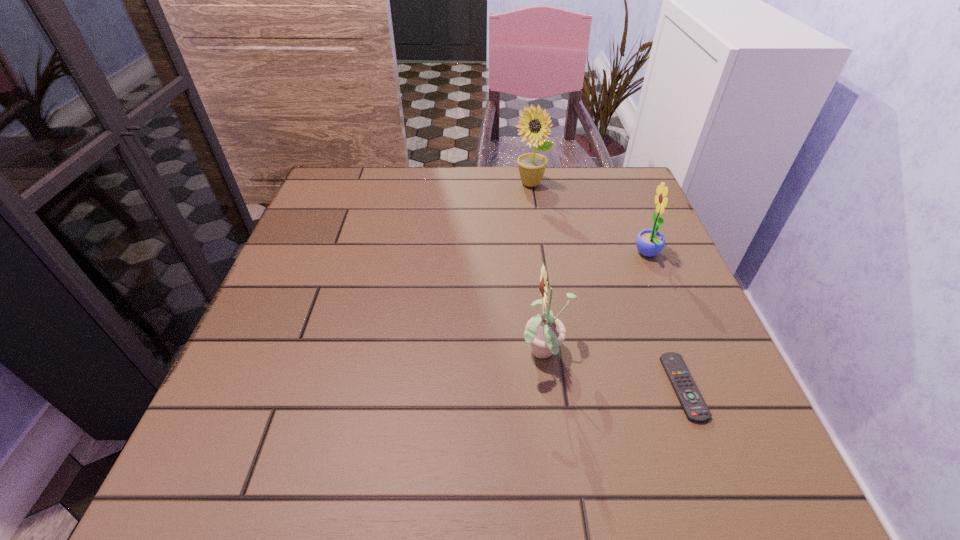
The width and height of the screenshot is (960, 540). I want to click on unoccupied area between the rightmost sunflower and the farthest sunflower, so click(588, 219).

I want to click on object identified as the second closest to the rightmost sunflower, so click(545, 333).

Choose which object is the third nearest neighbor to the shortest object. Please provide its 2D coordinates. Your answer should be formatted as a tuple, i.e. [(x, y)], where the tuple contains the x and y coordinates of a point satisfying the conditions above.

[(532, 166)]

Locate which sunflower is the second closest to the remote control. Please provide its 2D coordinates. Your answer should be formatted as a tuple, i.e. [(x, y)], where the tuple contains the x and y coordinates of a point satisfying the conditions above.

[(649, 242)]

Where is `sunflower that can be found as the second closest to the remote control`? Image resolution: width=960 pixels, height=540 pixels. sunflower that can be found as the second closest to the remote control is located at coordinates [649, 242].

Find the location of a particular element. Image resolution: width=960 pixels, height=540 pixels. free spot that satisfies the following two spatial constraints: 1. on the face of the farthest object; 2. on the front-facing side of the nearest sunflower is located at coordinates (556, 354).

I want to click on free space that satisfies the following two spatial constraints: 1. on the face of the farthest sunflower; 2. on the left side of the remote control, so click(561, 387).

Locate an element on the screen. This screenshot has height=540, width=960. vacant region that satisfies the following two spatial constraints: 1. on the face of the farthest object; 2. on the front-facing side of the nearest sunflower is located at coordinates (556, 354).

Locate an element on the screen. free spot that satisfies the following two spatial constraints: 1. on the face of the farthest sunflower; 2. on the front-facing side of the nearest sunflower is located at coordinates (556, 354).

In order to click on vacant area that satisfies the following two spatial constraints: 1. on the front-facing side of the nearest sunflower; 2. on the right side of the remote control in this screenshot , I will do `click(549, 387)`.